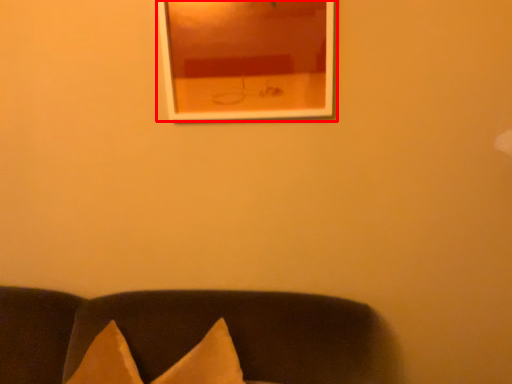
Question: Considering the relative positions of picture frame (annotated by the red box) and furniture in the image provided, where is picture frame (annotated by the red box) located with respect to the staircase?

Choices:
 (A) left
 (B) right

Answer: (B)